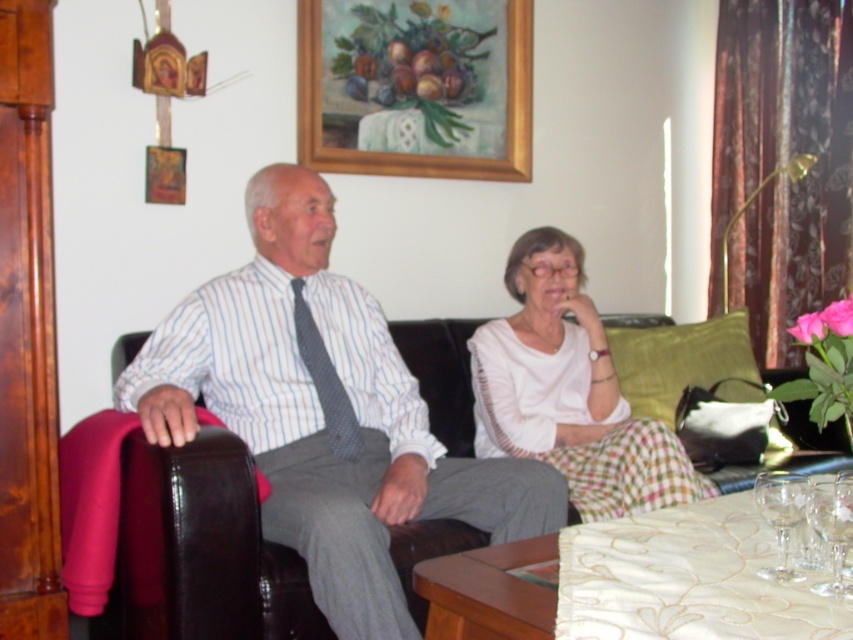
Question: Is black leather couch at center wider than wooden frame at upper center?

Choices:
 (A) yes
 (B) no

Answer: (A)

Question: Which of these objects is positioned closest to the clear glass wine glass at lower right?

Choices:
 (A) black leather couch at center
 (B) striped cotton shirt at center

Answer: (A)

Question: Can you confirm if transparent glass wine glass at lower right is smaller than clear glass wine glass at lower right?

Choices:
 (A) no
 (B) yes

Answer: (A)

Question: Which point is farther from the camera taking this photo?

Choices:
 (A) (787, 552)
 (B) (611, 504)

Answer: (B)

Question: Where is striped cotton shirt at center located in relation to transparent glass wine glass at lower right in the image?

Choices:
 (A) below
 (B) above

Answer: (B)

Question: Which object appears closest to the camera in this image?

Choices:
 (A) wooden frame at upper center
 (B) striped cotton shirt at center

Answer: (B)